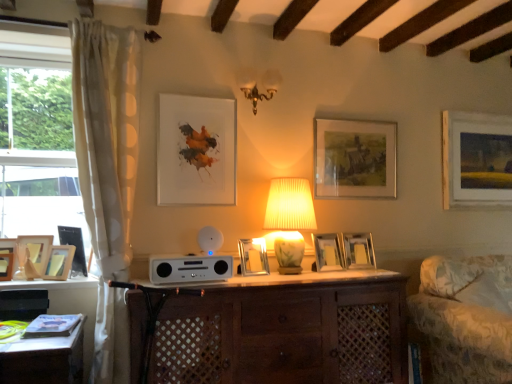
Where is `free space above wooden desk at lower left (from a real-world perspective)`? This screenshot has height=384, width=512. free space above wooden desk at lower left (from a real-world perspective) is located at coordinates (28, 332).